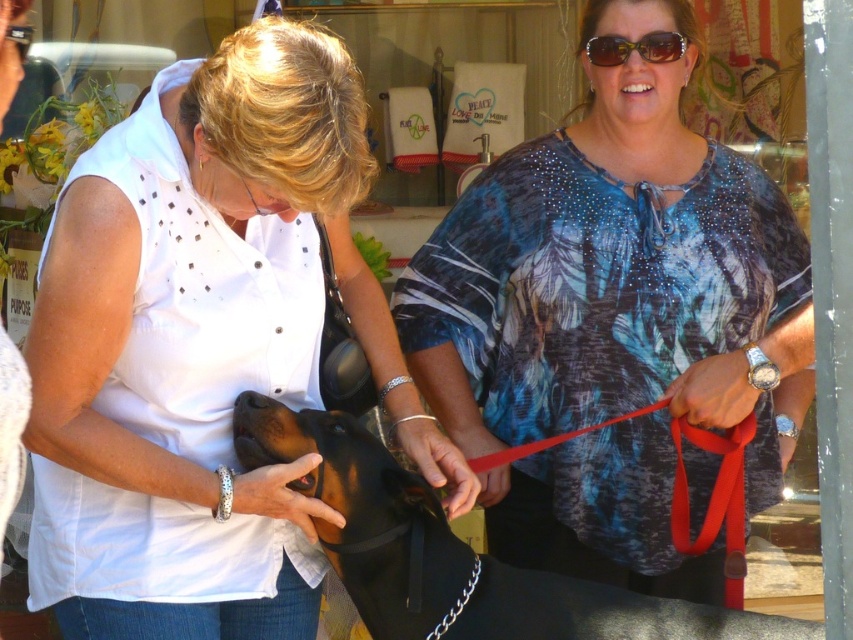
You are a fashion designer observing the scene. You need to choose between the red fabric leash at center right and the sunglasses at upper center for a new accessory line. Which item would require more material to produce based on their sizes in the image?

The red fabric leash at center right is bigger than the sunglasses at upper center, so it would require more material to produce.

Based on the coordinates provided in the scene description, where is the white dotted shirt at center located?

The white dotted shirt at center is located at point coordinates of 0.542 on the x axis and 0.239 on the y axis.